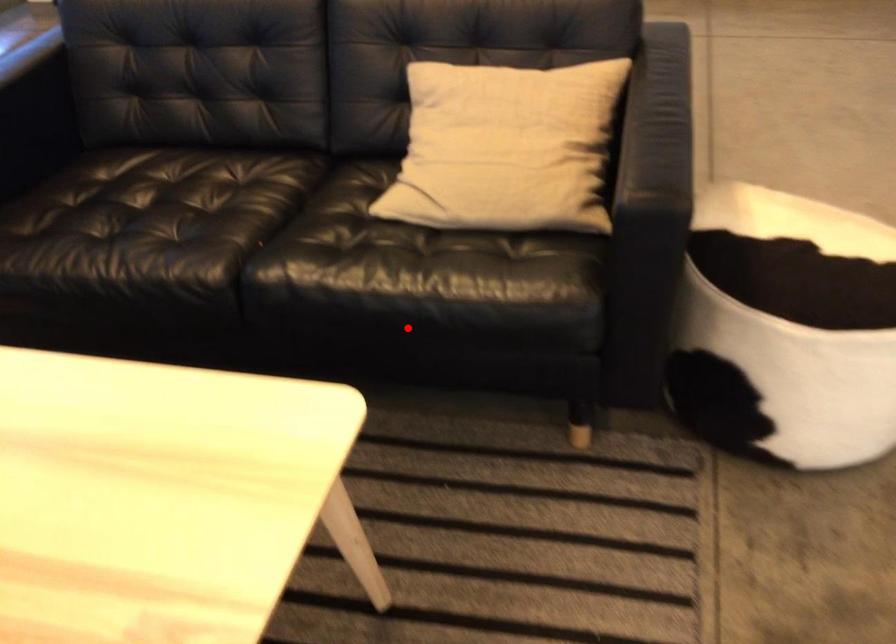
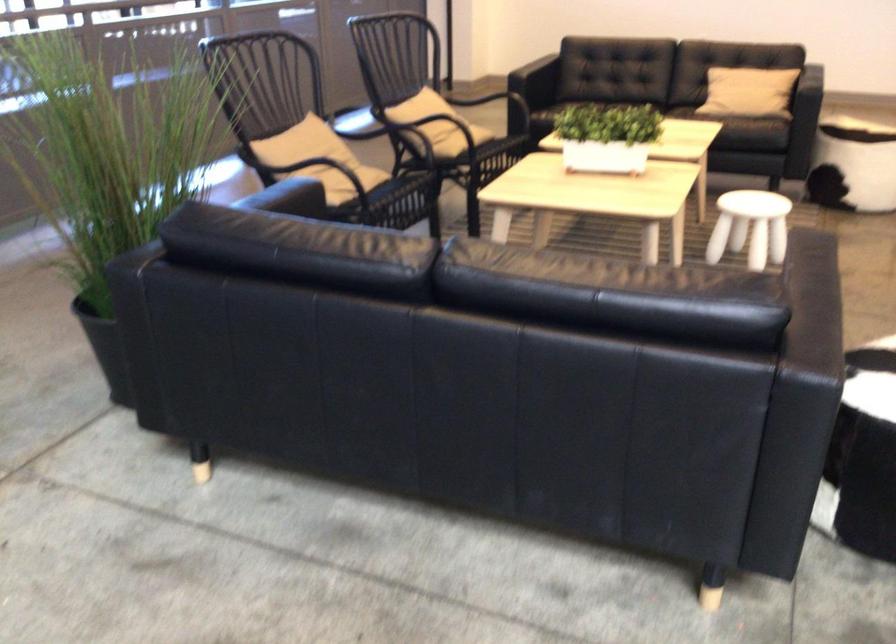
Question: A red point is marked in image1. In image2, is the corresponding 3D point closer to the camera or farther? Reply with the corresponding letter.

Choices:
 (A) The corresponding 3D point is closer.
 (B) The corresponding 3D point is farther.

Answer: (B)